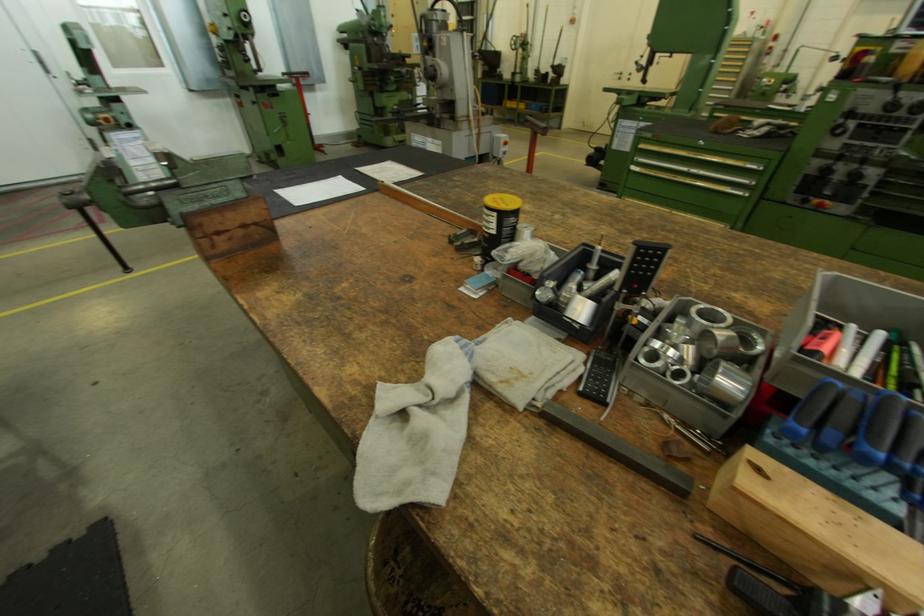
The location [723,384] corresponds to which object?

This point indicates the hollow metal cylinder.